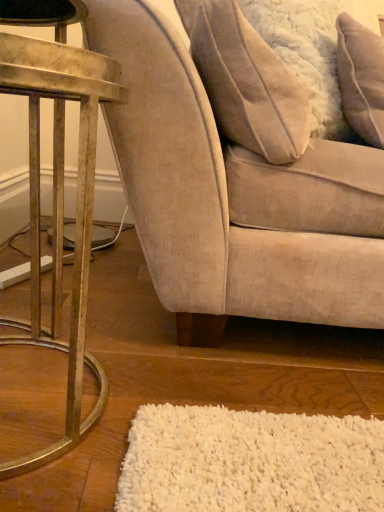
Question: Is the position of white fluffy pillow at upper right, the first pillow in the right-to-left sequence, less distant than that of beige fabric chair at center?

Choices:
 (A) no
 (B) yes

Answer: (A)

Question: From a real-world perspective, is white fluffy pillow at upper right, the first pillow in the right-to-left sequence, physically below beige fabric chair at center?

Choices:
 (A) no
 (B) yes

Answer: (A)

Question: Is white fluffy pillow at upper right, the first pillow in the right-to-left sequence, taller than beige fabric chair at center?

Choices:
 (A) yes
 (B) no

Answer: (B)

Question: Considering the relative positions of white fluffy pillow at upper right, the first pillow in the right-to-left sequence, and beige fabric chair at center in the image provided, is white fluffy pillow at upper right, the first pillow in the right-to-left sequence, to the right of beige fabric chair at center from the viewer's perspective?

Choices:
 (A) no
 (B) yes

Answer: (B)

Question: Can we say white fluffy pillow at upper right, the first pillow in the right-to-left sequence, lies outside beige fabric chair at center?

Choices:
 (A) yes
 (B) no

Answer: (B)

Question: From a real-world perspective, is white fluffy pillow at upper right, the second pillow from the left, located higher than beige fabric chair at center?

Choices:
 (A) yes
 (B) no

Answer: (A)

Question: Considering the relative sizes of white fluffy pillow at upper right, the second pillow from the left, and metallic gold table at left in the image provided, is white fluffy pillow at upper right, the second pillow from the left, wider than metallic gold table at left?

Choices:
 (A) yes
 (B) no

Answer: (B)

Question: Are white fluffy pillow at upper right, the second pillow from the left, and metallic gold table at left beside each other?

Choices:
 (A) no
 (B) yes

Answer: (A)

Question: Can we say white fluffy pillow at upper right, the second pillow from the left, lies outside metallic gold table at left?

Choices:
 (A) yes
 (B) no

Answer: (A)

Question: Is white fluffy pillow at upper right, the first pillow in the right-to-left sequence, surrounding metallic gold table at left?

Choices:
 (A) no
 (B) yes

Answer: (A)

Question: Does white fluffy pillow at upper right, the first pillow in the right-to-left sequence, have a smaller size compared to metallic gold table at left?

Choices:
 (A) no
 (B) yes

Answer: (B)

Question: Is white fluffy pillow at upper right, the first pillow in the right-to-left sequence, oriented towards metallic gold table at left?

Choices:
 (A) yes
 (B) no

Answer: (B)

Question: Is white fluffy pillow at upper right, the first pillow in the right-to-left sequence, positioned with its back to beige fabric pillow at upper right, which is counted as the 2th pillow, starting from the right?

Choices:
 (A) yes
 (B) no

Answer: (A)